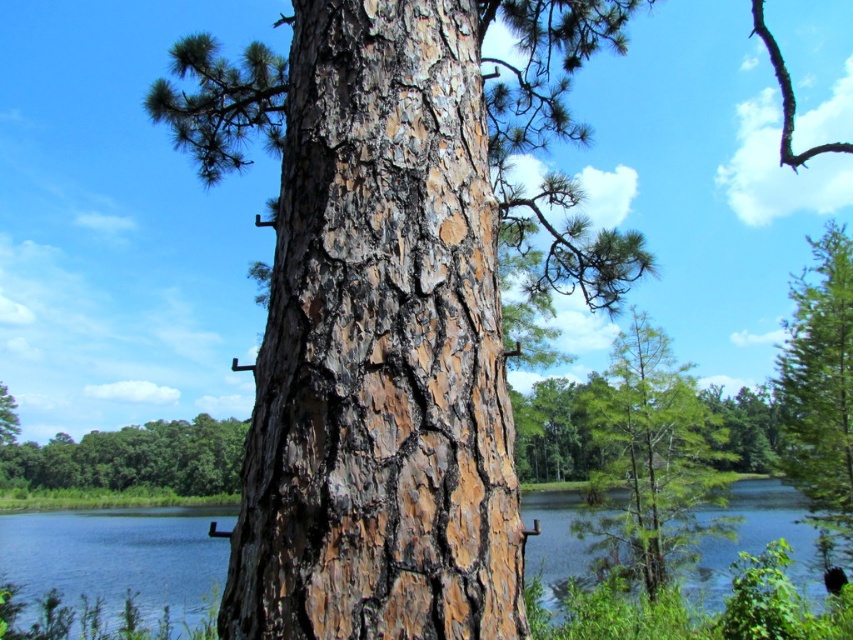
Does brown rough bark at center have a lesser height compared to green matte tree at right?

Yes, brown rough bark at center is shorter than green matte tree at right.

Is brown rough bark at center below green matte tree at right?

No, brown rough bark at center is not below green matte tree at right.

Image resolution: width=853 pixels, height=640 pixels. I want to click on brown rough bark at center, so click(380, 348).

You are a GUI agent. You are given a task and a screenshot of the screen. Output one action in this format:
    pyautogui.click(x=<x>, y=<y>)
    Task: Click on the brown rough bark at center
    This screenshot has height=640, width=853.
    Given the screenshot: What is the action you would take?
    pyautogui.click(x=380, y=348)

Looking at this image, which is more to the left, brown rough bark at center or green matte tree at center?

From the viewer's perspective, brown rough bark at center appears more on the left side.

Does point (289, 516) come farther from viewer compared to point (630, 541)?

No.

Identify the location of brown rough bark at center. (380, 348).

Is the position of green matte tree at right more distant than that of green rough bark tree at lower left?

No.

Is green matte tree at right shorter than green rough bark tree at lower left?

Incorrect, green matte tree at right's height does not fall short of green rough bark tree at lower left's.

Which is in front, point (837, 289) or point (125, 429)?

Positioned in front is point (837, 289).

Locate an element on the screen. green matte tree at right is located at coordinates (820, 387).